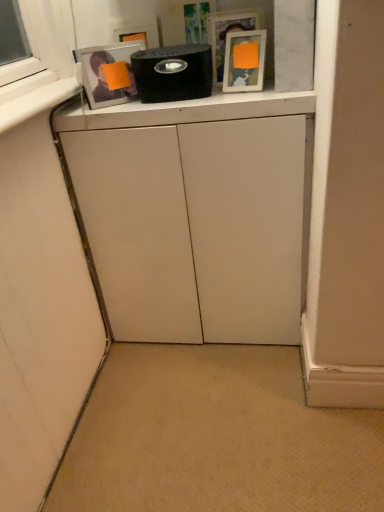
Measure the distance between point [116,131] and camera.

Point [116,131] is 1.25 meters away from camera.

Locate an element on the screen. The image size is (384, 512). white matte cabinet at center is located at coordinates (195, 215).

In the scene shown: Measure the distance between matte white picture frame at upper center and camera.

1.25 meters.

Find the location of `white matte cabinet at center`. white matte cabinet at center is located at coordinates (195, 215).

Does black matte speaker at upper center turn towards matte white picture frame at upper center?

No, black matte speaker at upper center is not facing towards matte white picture frame at upper center.

Considering the relative sizes of black matte speaker at upper center and matte white picture frame at upper center in the image provided, is black matte speaker at upper center shorter than matte white picture frame at upper center?

Yes.

Is black matte speaker at upper center wider or thinner than matte white picture frame at upper center?

black matte speaker at upper center is wider than matte white picture frame at upper center.

Considering the points (172, 85) and (243, 59), which point is behind, point (172, 85) or point (243, 59)?

The point (243, 59) is farther from the camera.

Choose the correct answer: Is matte white picture frame at upper center inside white matte cabinet at center or outside it?

matte white picture frame at upper center exists outside the volume of white matte cabinet at center.

Is matte white picture frame at upper center turned away from white matte cabinet at center?

No, matte white picture frame at upper center is not facing the opposite direction of white matte cabinet at center.

Between matte white picture frame at upper center and white matte cabinet at center, which one appears on the right side from the viewer's perspective?

Positioned to the right is matte white picture frame at upper center.

Which point is more forward, (260, 76) or (222, 238)?

The point (260, 76) is closer.

Can you confirm if matte white picture frame at upper center is positioned to the right of black matte speaker at upper center?

Correct, you'll find matte white picture frame at upper center to the right of black matte speaker at upper center.

Looking at their sizes, would you say matte white picture frame at upper center is wider or thinner than black matte speaker at upper center?

matte white picture frame at upper center is thinner than black matte speaker at upper center.

Which of these two, matte white picture frame at upper center or black matte speaker at upper center, is smaller?

Smaller between the two is matte white picture frame at upper center.

Where is `picture frame above the black matte speaker at upper center (from the image's perspective)`? Image resolution: width=384 pixels, height=512 pixels. picture frame above the black matte speaker at upper center (from the image's perspective) is located at coordinates (244, 61).

Is point (199, 52) closer to viewer compared to point (80, 126)?

That is True.

Can you confirm if black matte speaker at upper center is positioned to the left of white matte cabinet at center?

Yes, black matte speaker at upper center is to the left of white matte cabinet at center.

Would you say black matte speaker at upper center is outside white matte cabinet at center?

Indeed, black matte speaker at upper center is completely outside white matte cabinet at center.

Is black matte speaker at upper center looking in the opposite direction of white matte cabinet at center?

No.

Is white matte cabinet at center oriented away from black matte speaker at upper center?

white matte cabinet at center is not turned away from black matte speaker at upper center.

Consider the image. Does white matte cabinet at center have a greater width compared to black matte speaker at upper center?

Yes, white matte cabinet at center is wider than black matte speaker at upper center.

In the scene shown: Which of these two, white matte cabinet at center or black matte speaker at upper center, is smaller?

Smaller between the two is black matte speaker at upper center.

Is there a large distance between white matte cabinet at center and matte white picture frame at upper center?

That's not correct — white matte cabinet at center is a little close to matte white picture frame at upper center.

Does point (201, 139) appear closer or farther from the camera than point (226, 77)?

Point (201, 139) appears to be closer to the viewer than point (226, 77).

Based on their sizes in the image, would you say white matte cabinet at center is bigger or smaller than matte white picture frame at upper center?

Considering their sizes, white matte cabinet at center takes up more space than matte white picture frame at upper center.

Does white matte cabinet at center have a greater height compared to matte white picture frame at upper center?

Indeed, white matte cabinet at center has a greater height compared to matte white picture frame at upper center.

Where is `appliance on the left of matte white picture frame at upper center`? appliance on the left of matte white picture frame at upper center is located at coordinates (173, 73).

Identify the location of cabinetry lying below the matte white picture frame at upper center (from the image's perspective). (195, 215).

Based on their spatial positions, is black matte speaker at upper center or matte white picture frame at upper center closer to white matte cabinet at center?

Among the two, black matte speaker at upper center is located nearer to white matte cabinet at center.

Based on their spatial positions, is white matte cabinet at center or black matte speaker at upper center further from matte white picture frame at upper center?

Among the two, white matte cabinet at center is located further to matte white picture frame at upper center.

Looking at the image, which one is located closer to black matte speaker at upper center, white matte cabinet at center or matte white picture frame at upper center?

matte white picture frame at upper center lies closer to black matte speaker at upper center than the other object.

Looking at the image, which one is located closer to black matte speaker at upper center, matte white picture frame at upper center or white matte cabinet at center?

Based on the image, matte white picture frame at upper center appears to be nearer to black matte speaker at upper center.

Consider the image. When comparing their distances from matte white picture frame at upper center, does black matte speaker at upper center or white matte cabinet at center seem closer?

Among the two, black matte speaker at upper center is located nearer to matte white picture frame at upper center.

Which object lies nearer to the anchor point white matte cabinet at center, matte white picture frame at upper center or black matte speaker at upper center?

black matte speaker at upper center lies closer to white matte cabinet at center than the other object.

I want to click on appliance between matte white picture frame at upper center and white matte cabinet at center in the up-down direction, so [173, 73].